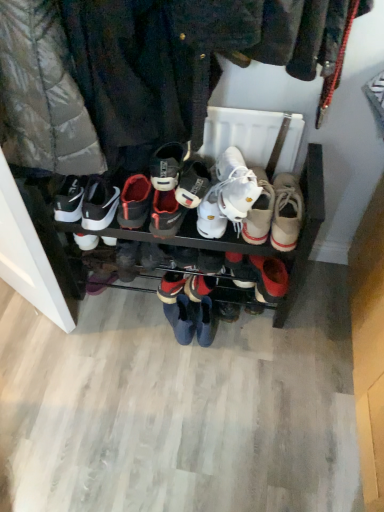
In order to face blue suede boots at center, marked as the 5th footwear in a right-to-left arrangement, should I rotate leftwards or rightwards?

A 2.143 degree turn to the left will do.

This screenshot has width=384, height=512. What are the coordinates of `white leather sneaker at center, which is the second footwear from left to right` in the screenshot? It's located at (168, 165).

Describe the element at coordinates (197, 263) in the screenshot. The width and height of the screenshot is (384, 512). I see `white leather sneakers at center, positioned as the 5th footwear in left-to-right order` at that location.

How much space does white leather sneakers at center, which is the 4th footwear from right to left, occupy vertically?

white leather sneakers at center, which is the 4th footwear from right to left, is 25.54 inches in height.

Identify the location of white canvas shoe at center, which is the 7th footwear from left to right. (259, 212).

At what (x,y) coordinates should I click in order to perform the action: click on blue suede boots at center, marked as the 5th footwear in a right-to-left arrangement. Please return your answer as a coordinate pair (x, y). This screenshot has width=384, height=512. Looking at the image, I should click on (181, 319).

From the image's perspective, is white synthetic shoe at center, the 3th footwear positioned from the left, located beneath black leather sneaker at center, the 1th footwear positioned from the left?

Actually, white synthetic shoe at center, the 3th footwear positioned from the left, appears above black leather sneaker at center, the 1th footwear positioned from the left, in the image.

Find the location of a particular element. the 3rd footwear above the black leather sneaker at center, the 1th footwear positioned from the left (from the image's perspective) is located at coordinates (166, 214).

Between white synthetic shoe at center, arranged as the sixth footwear when viewed from the right, and black leather sneaker at center, the eighth footwear in the right-to-left sequence, which one has smaller width?

Thinner between the two is black leather sneaker at center, the eighth footwear in the right-to-left sequence.

Is white synthetic shoe at center, arranged as the sixth footwear when viewed from the right, spatially inside black leather sneaker at center, the 1th footwear positioned from the left, or outside of it?

white synthetic shoe at center, arranged as the sixth footwear when viewed from the right, is spatially situated outside black leather sneaker at center, the 1th footwear positioned from the left.

Measure the distance between white canvas shoe at center, arranged as the second footwear when viewed from the right, and white leather sneaker at center, which is the second footwear from left to right.

white canvas shoe at center, arranged as the second footwear when viewed from the right, and white leather sneaker at center, which is the second footwear from left to right, are 10.12 inches apart from each other.

From a real-world perspective, who is located lower, white canvas shoe at center, which is the 7th footwear from left to right, or white leather sneaker at center, which is the second footwear from left to right?

white canvas shoe at center, which is the 7th footwear from left to right.

Between white canvas shoe at center, arranged as the second footwear when viewed from the right, and white leather sneaker at center, which is counted as the 7th footwear, starting from the right, which one has larger width?

Wider between the two is white canvas shoe at center, arranged as the second footwear when viewed from the right.

Would you say white canvas shoe at center, arranged as the second footwear when viewed from the right, is a long distance from white leather sneaker at center, which is counted as the 7th footwear, starting from the right?

white canvas shoe at center, arranged as the second footwear when viewed from the right, is actually quite close to white leather sneaker at center, which is counted as the 7th footwear, starting from the right.

Considering the relative sizes of white leather sneaker at center, which is counted as the 7th footwear, starting from the right, and white synthetic shoe at center, the 3th footwear positioned from the left, in the image provided, is white leather sneaker at center, which is counted as the 7th footwear, starting from the right, bigger than white synthetic shoe at center, the 3th footwear positioned from the left,?

No.

From a real-world perspective, is white leather sneaker at center, which is counted as the 7th footwear, starting from the right, above or below white synthetic shoe at center, arranged as the sixth footwear when viewed from the right?

Clearly, from a real-world perspective, white leather sneaker at center, which is counted as the 7th footwear, starting from the right, is above white synthetic shoe at center, arranged as the sixth footwear when viewed from the right.

Consider the image. Which object is positioned more to the left, white leather sneaker at center, which is counted as the 7th footwear, starting from the right, or white synthetic shoe at center, the 3th footwear positioned from the left?

Positioned to the left is white leather sneaker at center, which is counted as the 7th footwear, starting from the right.

Is white synthetic shoe at center, arranged as the sixth footwear when viewed from the right, located within white leather sneaker at center, which is counted as the 7th footwear, starting from the right?

No, white synthetic shoe at center, arranged as the sixth footwear when viewed from the right, is located outside of white leather sneaker at center, which is counted as the 7th footwear, starting from the right.

From the image's perspective, which one is positioned higher, white leather sneakers at center, acting as the third footwear starting from the right, or black leather sneaker at center, the 1th footwear positioned from the left?

white leather sneakers at center, acting as the third footwear starting from the right.

Is white leather sneakers at center, acting as the third footwear starting from the right, not near black leather sneaker at center, the 1th footwear positioned from the left?

white leather sneakers at center, acting as the third footwear starting from the right, is actually quite close to black leather sneaker at center, the 1th footwear positioned from the left.

From a real-world perspective, which is physically below, white leather sneakers at center, which is counted as the sixth footwear, starting from the left, or black leather sneaker at center, the eighth footwear in the right-to-left sequence?

black leather sneaker at center, the eighth footwear in the right-to-left sequence, from a real-world perspective.

What's the angular difference between white leather sneakers at center, acting as the third footwear starting from the right, and black leather sneaker at center, the eighth footwear in the right-to-left sequence,'s facing directions?

The angle between the facing direction of white leather sneakers at center, acting as the third footwear starting from the right, and the facing direction of black leather sneaker at center, the eighth footwear in the right-to-left sequence, is 12.2 degrees.

Based on the photo, which object is further away from the camera, white leather sneakers at center, which is counted as the sixth footwear, starting from the left, or white canvas shoe at center, which is the 7th footwear from left to right?

white leather sneakers at center, which is counted as the sixth footwear, starting from the left.

This screenshot has width=384, height=512. In order to click on footwear that is the 1st one when counting leftward from the white canvas shoe at center, arranged as the second footwear when viewed from the right in this screenshot , I will do `click(228, 196)`.

Could white canvas shoe at center, arranged as the second footwear when viewed from the right, be considered to be inside white leather sneakers at center, which is counted as the sixth footwear, starting from the left?

No, white canvas shoe at center, arranged as the second footwear when viewed from the right, is not a part of white leather sneakers at center, which is counted as the sixth footwear, starting from the left.

Does white leather sneakers at center, acting as the third footwear starting from the right, have a lesser height compared to white canvas shoe at center, arranged as the second footwear when viewed from the right?

Indeed, white leather sneakers at center, acting as the third footwear starting from the right, has a lesser height compared to white canvas shoe at center, arranged as the second footwear when viewed from the right.

Does white synthetic shoe at center, the 3th footwear positioned from the left, have a smaller size compared to white canvas shoe at center, arranged as the second footwear when viewed from the right?

Correct, white synthetic shoe at center, the 3th footwear positioned from the left, occupies less space than white canvas shoe at center, arranged as the second footwear when viewed from the right.

Can you tell me how much white synthetic shoe at center, arranged as the sixth footwear when viewed from the right, and white canvas shoe at center, arranged as the second footwear when viewed from the right, differ in facing direction?

There is a 6.16e-05-degree angle between the facing directions of white synthetic shoe at center, arranged as the sixth footwear when viewed from the right, and white canvas shoe at center, arranged as the second footwear when viewed from the right.

From a real-world perspective, is white synthetic shoe at center, the 3th footwear positioned from the left, over white canvas shoe at center, arranged as the second footwear when viewed from the right?

No, from a real-world perspective, white synthetic shoe at center, the 3th footwear positioned from the left, is not on top of white canvas shoe at center, arranged as the second footwear when viewed from the right.

Considering the relative positions of white synthetic shoe at center, the 3th footwear positioned from the left, and white canvas shoe at center, arranged as the second footwear when viewed from the right, in the image provided, is white synthetic shoe at center, the 3th footwear positioned from the left, behind white canvas shoe at center, arranged as the second footwear when viewed from the right,?

Yes, white synthetic shoe at center, the 3th footwear positioned from the left, is behind white canvas shoe at center, arranged as the second footwear when viewed from the right.

Is white canvas shoe at center, arranged as the second footwear when viewed from the right, not near white leather sneakers at center, which is counted as the sixth footwear, starting from the left?

No, white canvas shoe at center, arranged as the second footwear when viewed from the right, is not far away from white leather sneakers at center, which is counted as the sixth footwear, starting from the left.

Where is `footwear that is the 2nd object directly below the white canvas shoe at center, which is the 7th footwear from left to right (from a real-world perspective)`? The image size is (384, 512). footwear that is the 2nd object directly below the white canvas shoe at center, which is the 7th footwear from left to right (from a real-world perspective) is located at coordinates (228, 196).

From the image's perspective, who appears lower, white canvas shoe at center, which is the 7th footwear from left to right, or white leather sneakers at center, acting as the third footwear starting from the right?

white canvas shoe at center, which is the 7th footwear from left to right, appears lower in the image.

How distant is white canvas shoe at center, which is the 7th footwear from left to right, from white leather sneakers at center, acting as the third footwear starting from the right?

white canvas shoe at center, which is the 7th footwear from left to right, is 2.59 inches from white leather sneakers at center, acting as the third footwear starting from the right.

There is a black leather sneaker at center, the eighth footwear in the right-to-left sequence. Where is `the 3rd footwear above it (from the image's perspective)`? This screenshot has width=384, height=512. the 3rd footwear above it (from the image's perspective) is located at coordinates (166, 214).

From a real-world perspective, count 1st footwears downward from the white leather sneaker at center, which is the second footwear from left to right, and point to it. Please provide its 2D coordinates.

[(259, 212)]

Based on their spatial positions, is blue suede boots at center, marked as the 5th footwear in a right-to-left arrangement, or white leather sneaker at center, which is the second footwear from left to right, closer to white synthetic shoe at center, arranged as the sixth footwear when viewed from the right?

white leather sneaker at center, which is the second footwear from left to right, is closer to white synthetic shoe at center, arranged as the sixth footwear when viewed from the right.

Based on their spatial positions, is blue suede boots at center, the fourth footwear viewed from the left, or beige canvas shoe at center, marked as the first footwear in a right-to-left arrangement, further from white canvas shoe at center, arranged as the second footwear when viewed from the right?

Among the two, blue suede boots at center, the fourth footwear viewed from the left, is located further to white canvas shoe at center, arranged as the second footwear when viewed from the right.

When comparing their distances from white leather sneakers at center, which is counted as the sixth footwear, starting from the left, does white canvas shoe at center, arranged as the second footwear when viewed from the right, or white leather sneakers at center, which is the 4th footwear from right to left, seem closer?

white canvas shoe at center, arranged as the second footwear when viewed from the right, lies closer to white leather sneakers at center, which is counted as the sixth footwear, starting from the left, than the other object.

When comparing their distances from white canvas shoe at center, arranged as the second footwear when viewed from the right, does white leather sneakers at center, acting as the third footwear starting from the right, or white leather sneaker at center, which is the second footwear from left to right, seem further?

Among the two, white leather sneaker at center, which is the second footwear from left to right, is located further to white canvas shoe at center, arranged as the second footwear when viewed from the right.

Which object lies nearer to the anchor point white leather sneakers at center, positioned as the 5th footwear in left-to-right order, blue suede boots at center, the fourth footwear viewed from the left, or white leather sneaker at center, which is the second footwear from left to right?

Based on the image, blue suede boots at center, the fourth footwear viewed from the left, appears to be nearer to white leather sneakers at center, positioned as the 5th footwear in left-to-right order.

From the image, which object appears to be farther from beige canvas shoe at center, which appears as the 8th footwear when viewed from the left, white leather sneakers at center, which is the 4th footwear from right to left, or white leather sneaker at center, which is the second footwear from left to right?

The object further to beige canvas shoe at center, which appears as the 8th footwear when viewed from the left, is white leather sneaker at center, which is the second footwear from left to right.

Which object lies nearer to the anchor point black leather sneaker at center, the eighth footwear in the right-to-left sequence, blue suede boots at center, the fourth footwear viewed from the left, or white leather sneakers at center, which is the 4th footwear from right to left?

Based on the image, white leather sneakers at center, which is the 4th footwear from right to left, appears to be nearer to black leather sneaker at center, the eighth footwear in the right-to-left sequence.

Estimate the real-world distances between objects in this image. Which object is further from white synthetic shoe at center, the 3th footwear positioned from the left, white canvas shoe at center, which is the 7th footwear from left to right, or white leather sneakers at center, acting as the third footwear starting from the right?

white canvas shoe at center, which is the 7th footwear from left to right, is further to white synthetic shoe at center, the 3th footwear positioned from the left.

You are a GUI agent. You are given a task and a screenshot of the screen. Output one action in this format:
    pyautogui.click(x=<x>, y=<y>)
    Task: Click on the footwear located between white leather sneakers at center, which is counted as the sixth footwear, starting from the left, and beige canvas shoe at center, which appears as the 8th footwear when viewed from the left, in the left-right direction
    
    Given the screenshot: What is the action you would take?
    pyautogui.click(x=259, y=212)

Image resolution: width=384 pixels, height=512 pixels. What are the coordinates of `footwear between white leather sneakers at center, which is the 4th footwear from right to left, and white canvas shoe at center, arranged as the second footwear when viewed from the right, from left to right` in the screenshot? It's located at (228, 196).